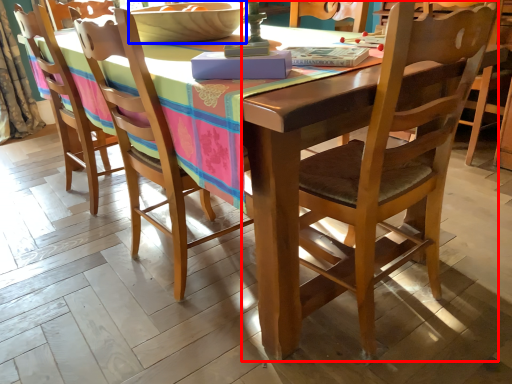
Question: Among these objects, which one is nearest to the camera, chair (highlighted by a red box) or bowl (highlighted by a blue box)?

Choices:
 (A) chair
 (B) bowl

Answer: (A)